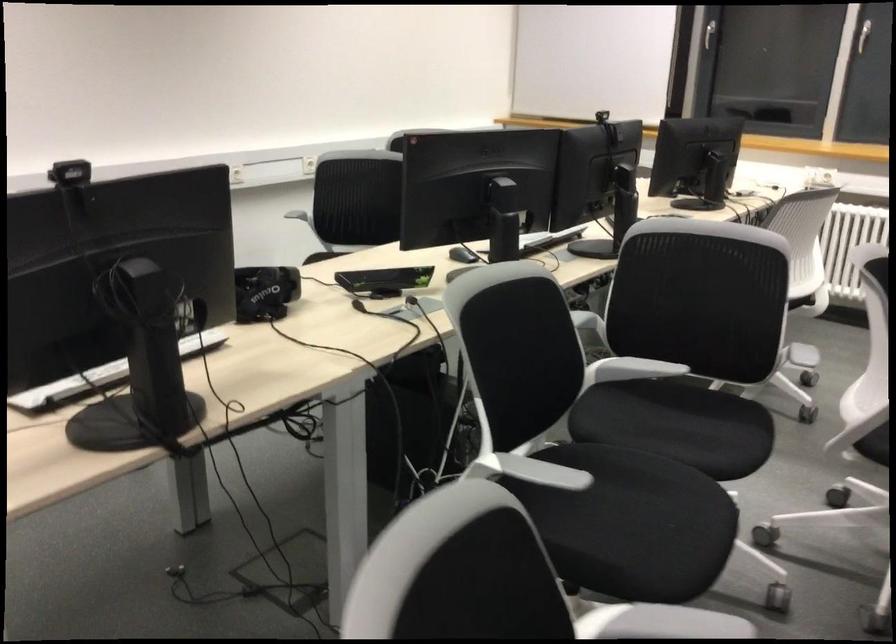
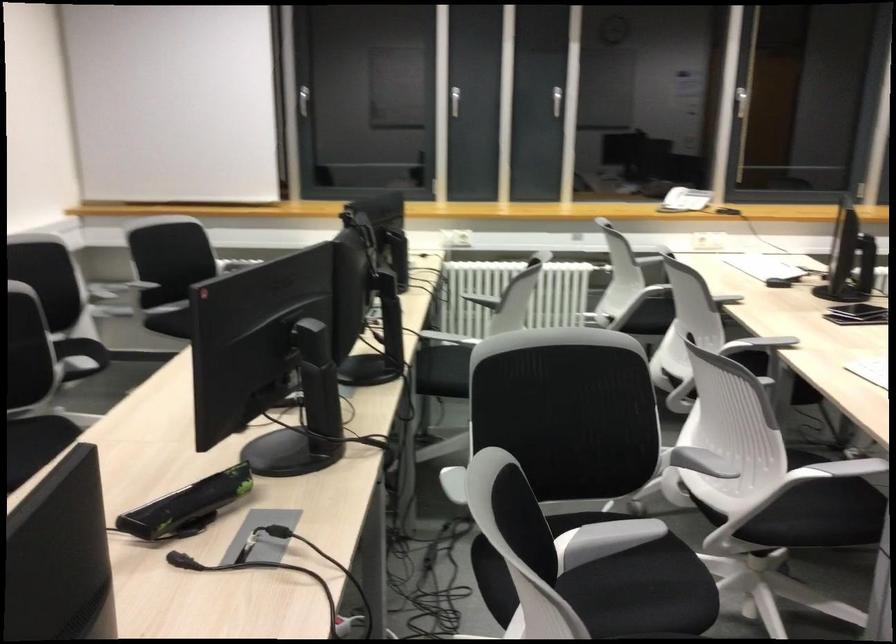
Question: The images are taken continuously from a first-person perspective. In which direction is your viewpoint rotating?

Choices:
 (A) Left
 (B) Right
 (C) Up
 (D) Down

Answer: (B)